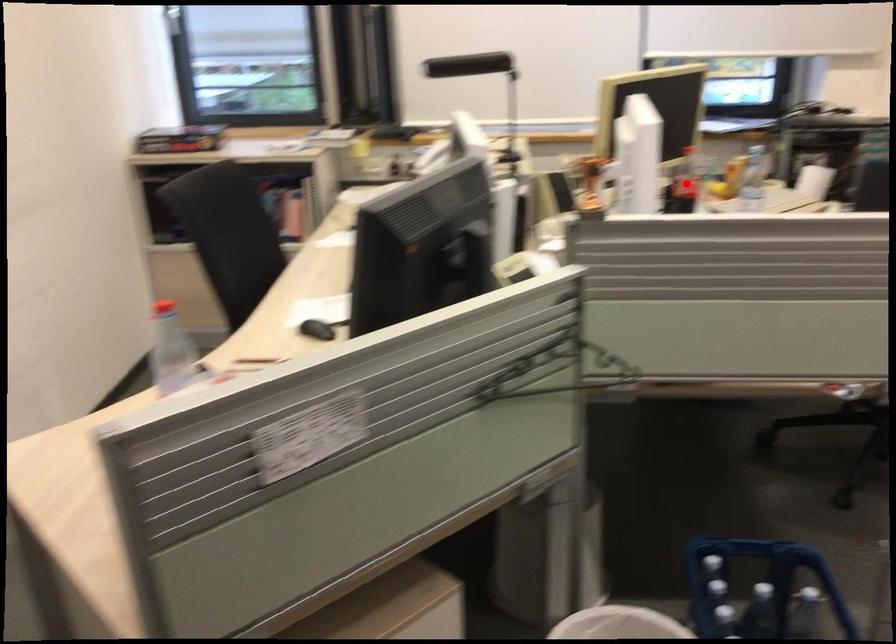
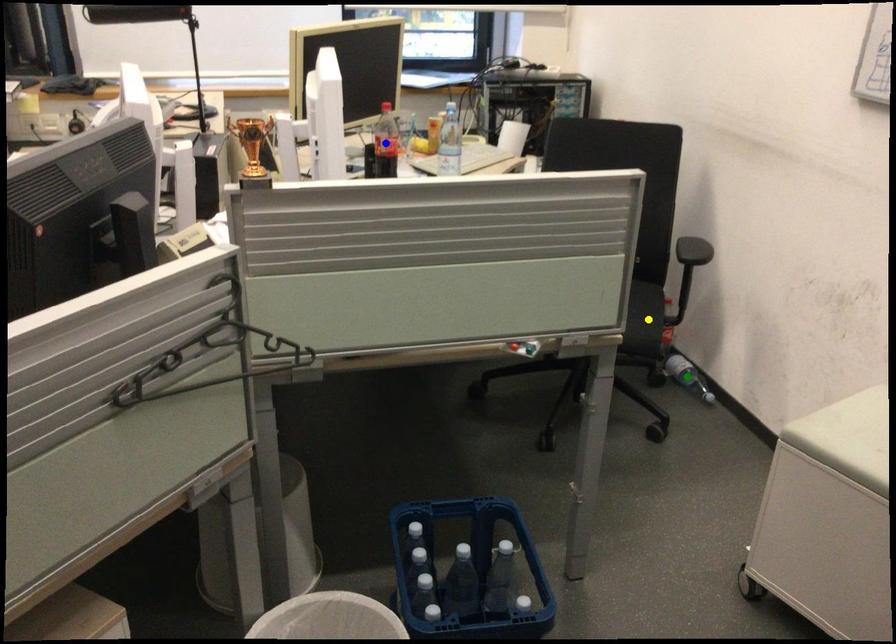
Question: I am providing you with two images of the same scene from different viewpoints. A red point is marked on the first image. You are given multiple points on the second image. Can you choose the point in image 2 that corresponds to the point in image 1?

Choices:
 (A) green point
 (B) blue point
 (C) yellow point

Answer: (B)